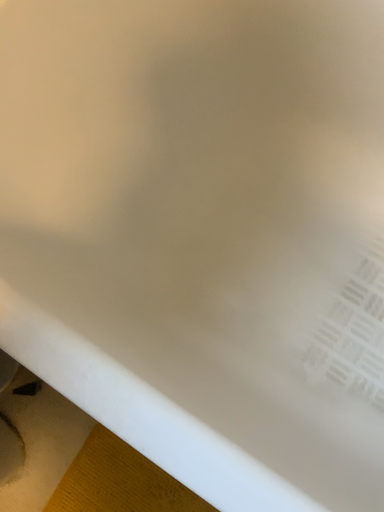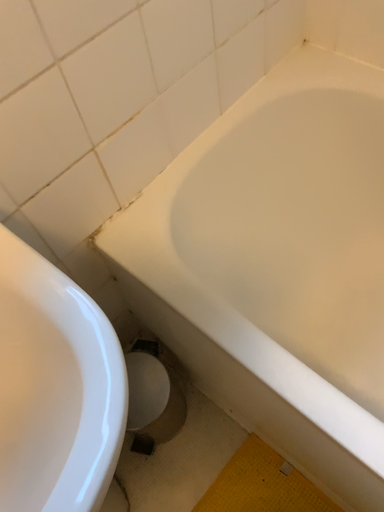
Question: Which way did the camera rotate in the video?

Choices:
 (A) rotated upward
 (B) rotated downward

Answer: (A)